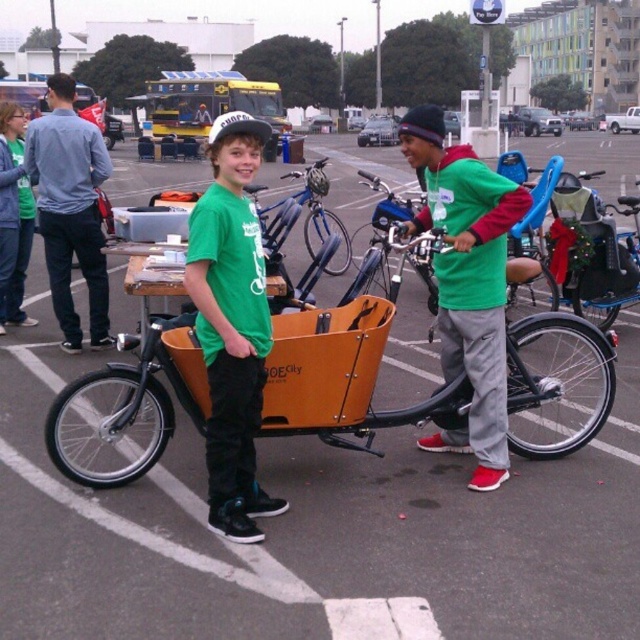
Question: Is blue denim jeans at left above yellow matte cargo bike at center?

Choices:
 (A) no
 (B) yes

Answer: (A)

Question: Does blue denim jeans at left have a smaller size compared to yellow matte cargo bike at center?

Choices:
 (A) no
 (B) yes

Answer: (B)

Question: Which object is closer to the camera taking this photo?

Choices:
 (A) yellow matte cargo bike at center
 (B) blue denim jeans at left
 (C) green matte jacket at center

Answer: (C)

Question: Does green matte jacket at center have a greater width compared to yellow matte cargo bike at center?

Choices:
 (A) yes
 (B) no

Answer: (B)

Question: Which point is closer to the camera?

Choices:
 (A) (216, 76)
 (B) (58, 148)
 (C) (236, 157)

Answer: (C)

Question: Which object appears closest to the camera in this image?

Choices:
 (A) yellow matte cargo bike at center
 (B) blue denim jeans at left
 (C) green matte shirt at center
 (D) matte green t-shirt at center

Answer: (C)